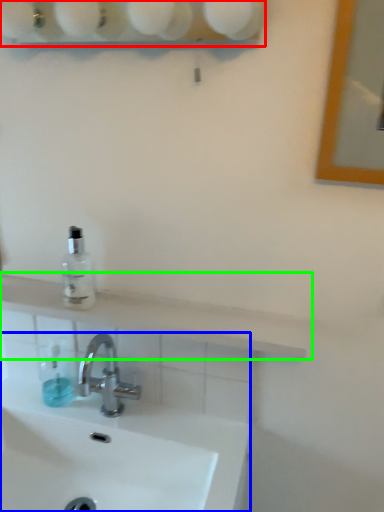
Question: Based on their relative distances, which object is farther from shelf (highlighted by a red box)? Choose from sink (highlighted by a blue box) and counter top (highlighted by a green box).

Choices:
 (A) sink
 (B) counter top

Answer: (A)